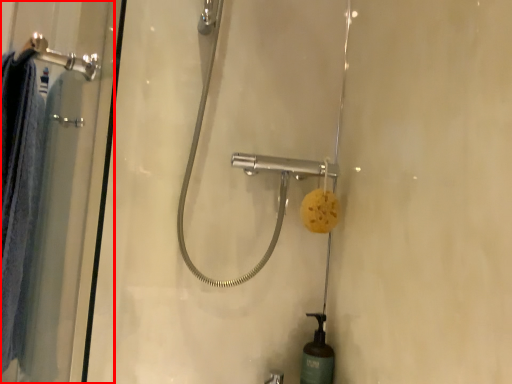
Question: From the image's perspective, what is the correct spatial positioning of shower door (annotated by the red box) in reference to shower?

Choices:
 (A) above
 (B) below

Answer: (B)